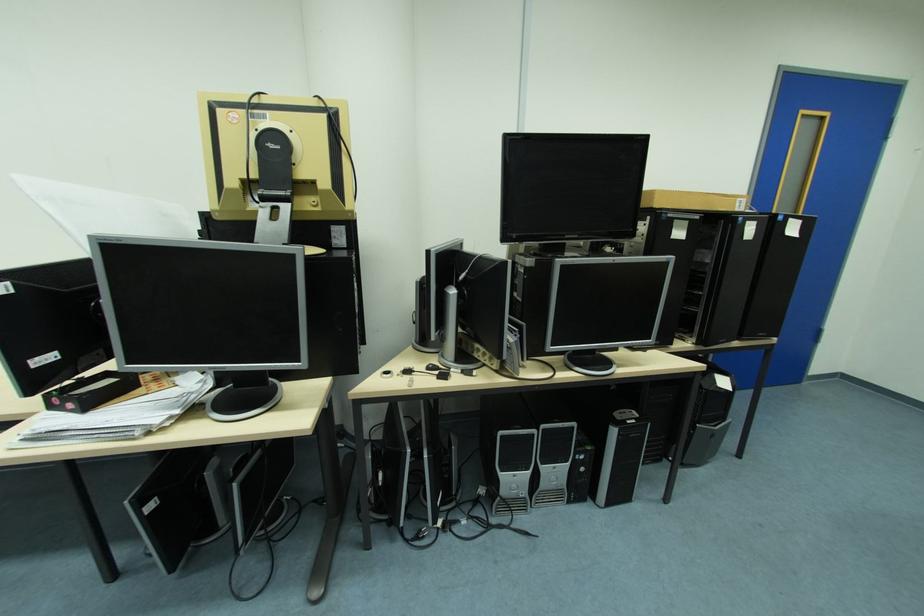
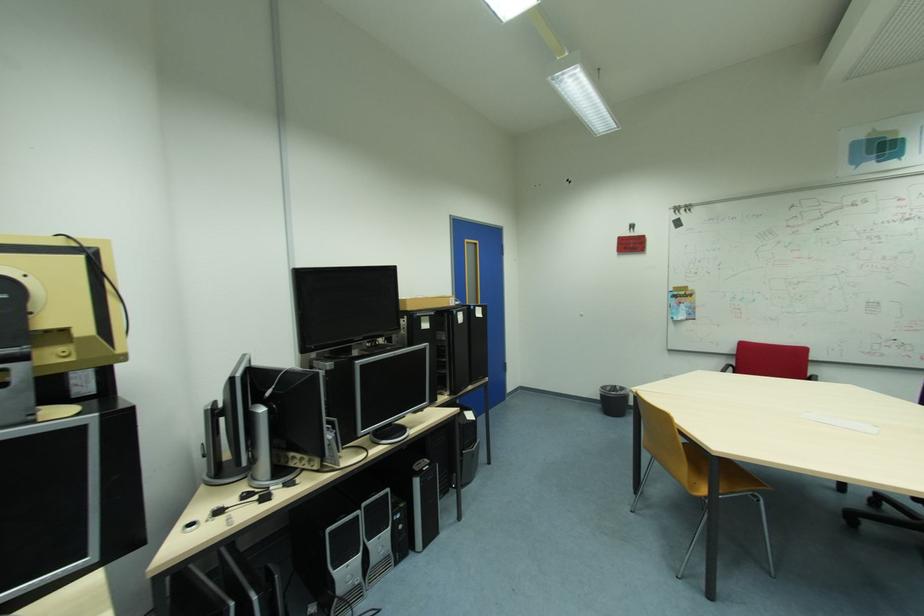
The point at (621, 432) is marked in the first image. Where is the corresponding point in the second image?

(424, 482)